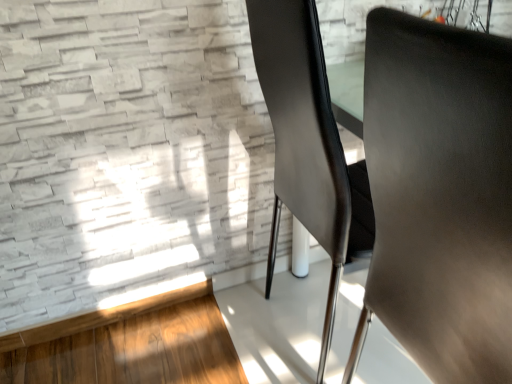
From the picture: What is the approximate width of matte black chair at center?

22.03 inches.

What do you see at coordinates (439, 196) in the screenshot?
I see `matte black chair at center` at bounding box center [439, 196].

Measure the distance between matte black chair at center and camera.

matte black chair at center is 14.37 inches from camera.

I want to click on matte black chair at center, so click(x=439, y=196).

Where is `matte black chair at center`? matte black chair at center is located at coordinates (439, 196).